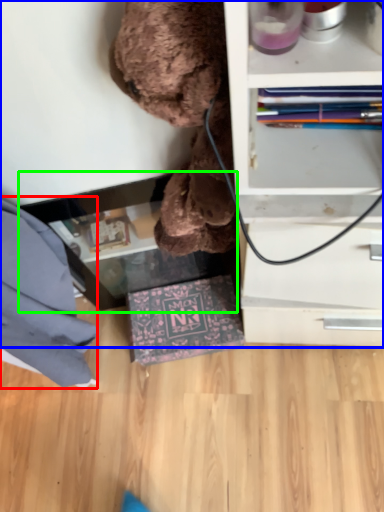
Question: Which object is the farthest from clothe (highlighted by a red box)? Choose among these: shelf (highlighted by a blue box) or table (highlighted by a green box).

Choices:
 (A) shelf
 (B) table

Answer: (A)